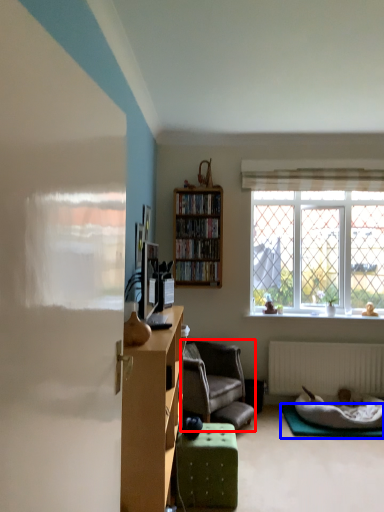
Question: Which object is closer to the camera taking this photo, chair (highlighted by a red box) or yoga mat (highlighted by a blue box)?

Choices:
 (A) chair
 (B) yoga mat

Answer: (A)